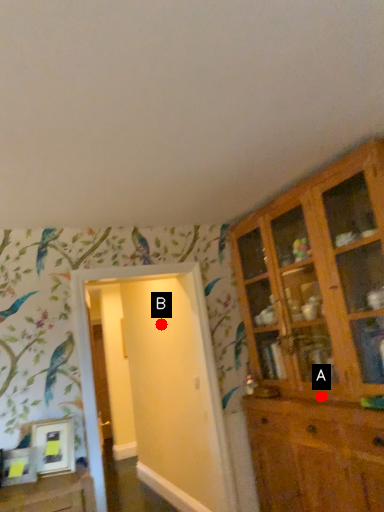
Question: Two points are circled on the image, labeled by A and B beside each circle. Which point appears closest to the camera in this image?

Choices:
 (A) A is closer
 (B) B is closer

Answer: (A)